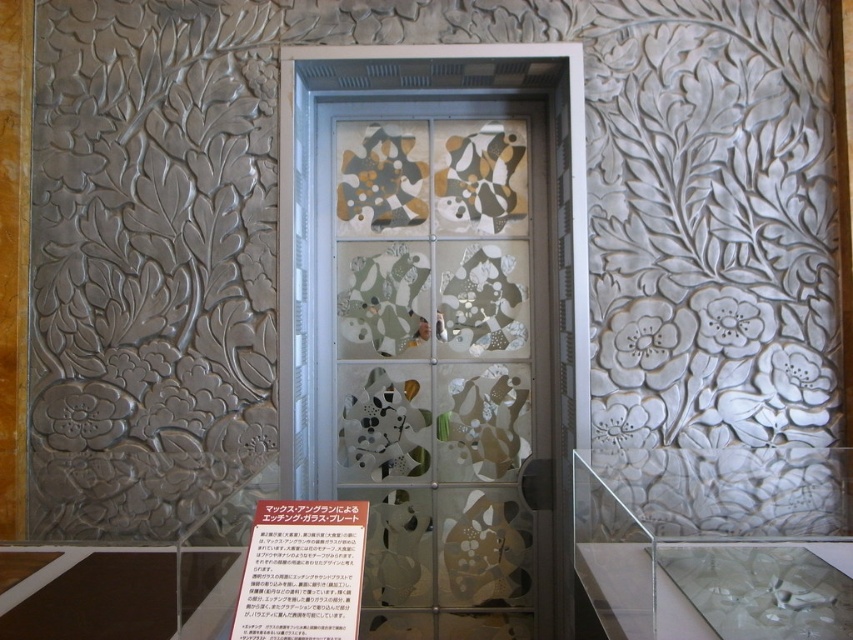
You are an interior designer trying to hang a new poster. You have a white paper at center and an etched glass door at center in front of you. Which object is taller so you can decide where to place the poster?

The etched glass door at center is taller than the white paper at center, so you should place the poster on the etched glass door at center to ensure it fits properly.

You are standing in the interior space and want to locate the etched glass door at center. According to the coordinates provided, where should you look to find it?

The etched glass door at center is located at point coordinates [444,364].